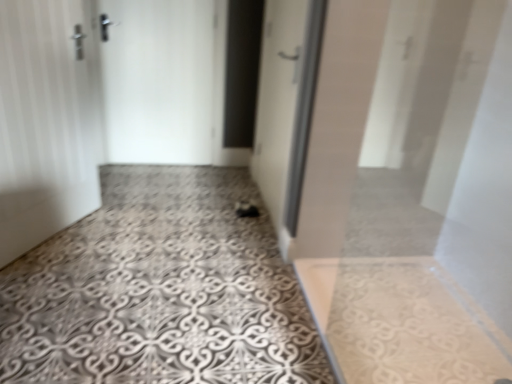
What do you see at coordinates (159, 81) in the screenshot? The image size is (512, 384). I see `white matte door at center, the 2th door in the right-to-left sequence` at bounding box center [159, 81].

Where is `white matte door at left, acting as the 1th door starting from the left`? The height and width of the screenshot is (384, 512). white matte door at left, acting as the 1th door starting from the left is located at coordinates (48, 119).

The height and width of the screenshot is (384, 512). Find the location of `white matte door at center, the second door in the left-to-right sequence`. white matte door at center, the second door in the left-to-right sequence is located at coordinates (159, 81).

Considering the sizes of white matte door at center, the second door in the left-to-right sequence, and patterned concrete floor at center in the image, is white matte door at center, the second door in the left-to-right sequence, wider or thinner than patterned concrete floor at center?

In the image, white matte door at center, the second door in the left-to-right sequence, appears to be more narrow than patterned concrete floor at center.

This screenshot has width=512, height=384. I want to click on the 1st door to the left of the patterned concrete floor at center, starting your count from the anchor, so coord(159,81).

Is white matte door at center, the 2th door in the right-to-left sequence, oriented towards patterned concrete floor at center?

Yes, white matte door at center, the 2th door in the right-to-left sequence, faces towards patterned concrete floor at center.

Would you say white matte door at center, the 2th door in the right-to-left sequence, contains patterned concrete floor at center?

Actually, patterned concrete floor at center is outside white matte door at center, the 2th door in the right-to-left sequence.

Considering the positions of objects patterned concrete floor at center and white matte door at left, the 3th door when ordered from right to left, in the image provided, who is in front, patterned concrete floor at center or white matte door at left, the 3th door when ordered from right to left,?

patterned concrete floor at center is more forward.

Is point (230, 334) closer or farther from the camera than point (60, 179)?

Point (230, 334) is closer to the camera than point (60, 179).

Is patterned concrete floor at center far from white matte door at left, the 3th door when ordered from right to left?

No.

Is white glossy door at center, the first door in the right-to-left sequence, touching patterned concrete floor at center?

No, white glossy door at center, the first door in the right-to-left sequence, is not in contact with patterned concrete floor at center.

From a real-world perspective, between white glossy door at center, the first door in the right-to-left sequence, and patterned concrete floor at center, who is vertically higher?

white glossy door at center, the first door in the right-to-left sequence, from a real-world perspective.

Which point is more distant from viewer, (265, 129) or (211, 382)?

The point (265, 129) is farther from the camera.

Looking at this image, how many degrees apart are the facing directions of white glossy door at center, which is the 3th door from left to right, and patterned concrete floor at center?

There is a 0.372-degree angle between the facing directions of white glossy door at center, which is the 3th door from left to right, and patterned concrete floor at center.

Is patterned concrete floor at center positioned beyond the bounds of white glossy door at center, the first door in the right-to-left sequence?

That's correct, patterned concrete floor at center is outside of white glossy door at center, the first door in the right-to-left sequence.

Between patterned concrete floor at center and white glossy door at center, which is the 3th door from left to right, which one has smaller size?

With smaller size is white glossy door at center, which is the 3th door from left to right.

Looking at this image, is white glossy door at center, the first door in the right-to-left sequence, touching white matte door at left, the 3th door when ordered from right to left?

No, white glossy door at center, the first door in the right-to-left sequence, is not with white matte door at left, the 3th door when ordered from right to left.

Can you confirm if white glossy door at center, which is the 3th door from left to right, is smaller than white matte door at left, acting as the 1th door starting from the left?

No, white glossy door at center, which is the 3th door from left to right, is not smaller than white matte door at left, acting as the 1th door starting from the left.

Measure the distance between white glossy door at center, which is the 3th door from left to right, and white matte door at left, acting as the 1th door starting from the left.

3.66 feet.

From a real-world perspective, which object rests below the other?

white matte door at left, acting as the 1th door starting from the left.

Is white matte door at center, the 2th door in the right-to-left sequence, directly adjacent to white matte door at left, the 3th door when ordered from right to left?

No, white matte door at center, the 2th door in the right-to-left sequence, is not in contact with white matte door at left, the 3th door when ordered from right to left.

From the image's perspective, which object appears higher, white matte door at center, the 2th door in the right-to-left sequence, or white matte door at left, acting as the 1th door starting from the left?

From the image's view, white matte door at center, the 2th door in the right-to-left sequence, is above.

Based on the photo, looking at their sizes, would you say white matte door at center, the second door in the left-to-right sequence, is wider or thinner than white matte door at left, the 3th door when ordered from right to left?

Clearly, white matte door at center, the second door in the left-to-right sequence, has less width compared to white matte door at left, the 3th door when ordered from right to left.

From the image's perspective, between patterned concrete floor at center and white matte door at center, the 2th door in the right-to-left sequence, who is located below?

patterned concrete floor at center is shown below in the image.

Who is shorter, patterned concrete floor at center or white matte door at center, the 2th door in the right-to-left sequence?

Standing shorter between the two is patterned concrete floor at center.

Do you think patterned concrete floor at center is within white matte door at center, the second door in the left-to-right sequence, or outside of it?

patterned concrete floor at center is outside white matte door at center, the second door in the left-to-right sequence.

Find the location of a particular element. Image resolution: width=512 pixels, height=384 pixels. the 2nd door above the patterned concrete floor at center (from a real-world perspective) is located at coordinates (159, 81).

Find the location of a particular element. This screenshot has width=512, height=384. concrete in front of the white matte door at left, acting as the 1th door starting from the left is located at coordinates (160, 290).

Based on the photo, based on their spatial positions, is white glossy door at center, the first door in the right-to-left sequence, or patterned concrete floor at center closer to white matte door at left, acting as the 1th door starting from the left?

patterned concrete floor at center is positioned closer to the anchor white matte door at left, acting as the 1th door starting from the left.

From the picture: Based on their spatial positions, is white matte door at center, the second door in the left-to-right sequence, or patterned concrete floor at center further from white glossy door at center, the first door in the right-to-left sequence?

The object further to white glossy door at center, the first door in the right-to-left sequence, is white matte door at center, the second door in the left-to-right sequence.

Considering their positions, is white glossy door at center, the first door in the right-to-left sequence, positioned closer to patterned concrete floor at center than white matte door at left, acting as the 1th door starting from the left?

white matte door at left, acting as the 1th door starting from the left, is positioned closer to the anchor patterned concrete floor at center.

When comparing their distances from white matte door at left, the 3th door when ordered from right to left, does white matte door at center, the 2th door in the right-to-left sequence, or patterned concrete floor at center seem further?

white matte door at center, the 2th door in the right-to-left sequence, is further to white matte door at left, the 3th door when ordered from right to left.

When comparing their distances from white matte door at left, acting as the 1th door starting from the left, does patterned concrete floor at center or white matte door at center, the second door in the left-to-right sequence, seem further?

white matte door at center, the second door in the left-to-right sequence.

Looking at the image, which one is located closer to white matte door at left, the 3th door when ordered from right to left, patterned concrete floor at center or white glossy door at center, which is the 3th door from left to right?

Among the two, patterned concrete floor at center is located nearer to white matte door at left, the 3th door when ordered from right to left.

Which object lies nearer to the anchor point white glossy door at center, the first door in the right-to-left sequence, white matte door at left, acting as the 1th door starting from the left, or patterned concrete floor at center?

patterned concrete floor at center lies closer to white glossy door at center, the first door in the right-to-left sequence, than the other object.

Looking at the image, which one is located further to white matte door at center, the 2th door in the right-to-left sequence, patterned concrete floor at center or white matte door at left, acting as the 1th door starting from the left?

patterned concrete floor at center.

Image resolution: width=512 pixels, height=384 pixels. What are the coordinates of `concrete located between white matte door at left, acting as the 1th door starting from the left, and white glossy door at center, which is the 3th door from left to right, in the left-right direction` in the screenshot? It's located at (160, 290).

Locate an element on the screen. This screenshot has height=384, width=512. door between white matte door at left, acting as the 1th door starting from the left, and white matte door at center, the 2th door in the right-to-left sequence, in the front-back direction is located at coordinates (286, 108).